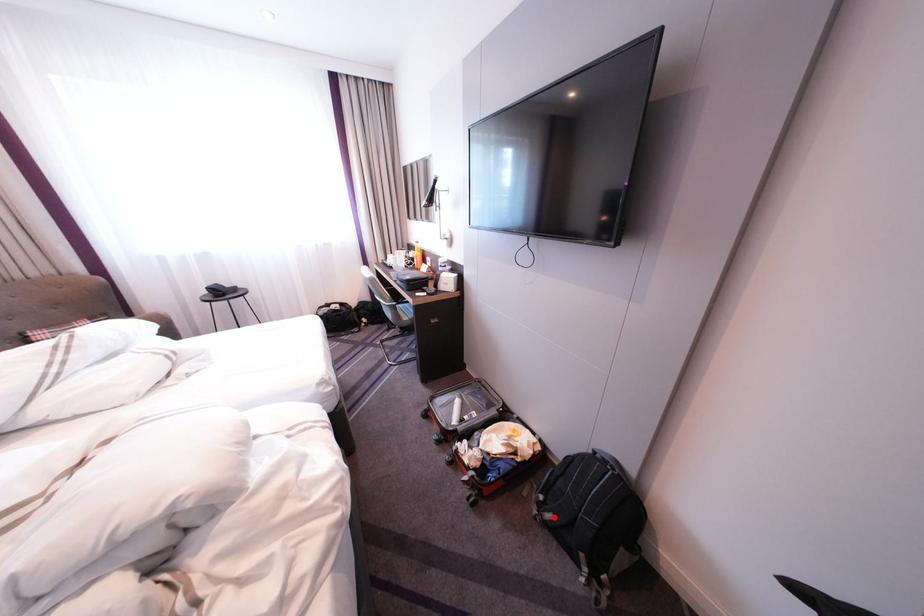
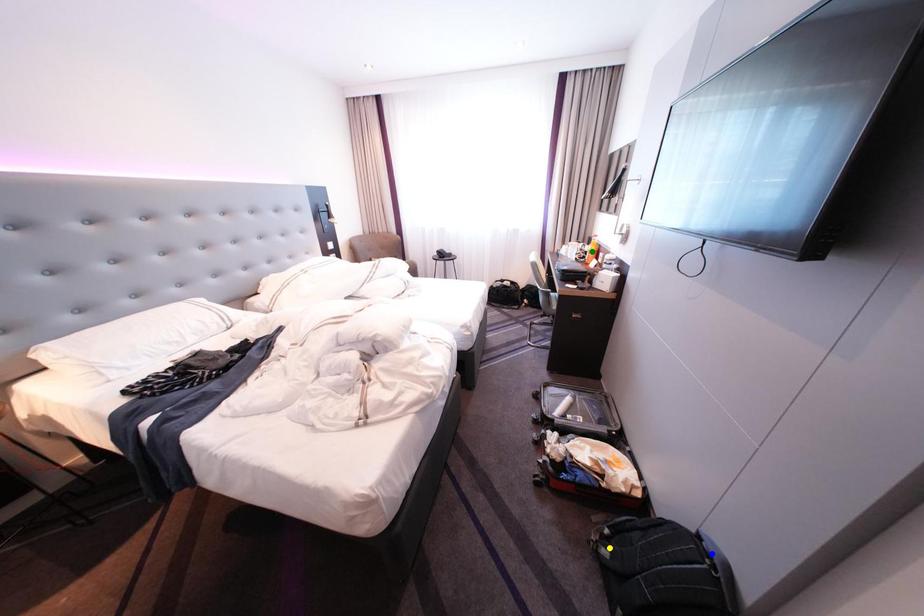
Question: I am providing you with two images of the same scene from different viewpoints. A red point is marked on the first image. You are given multiple points on the second image. Which point in image 2 represents the same 3d spot as the red point in image 1?

Choices:
 (A) blue point
 (B) green point
 (C) yellow point

Answer: (C)